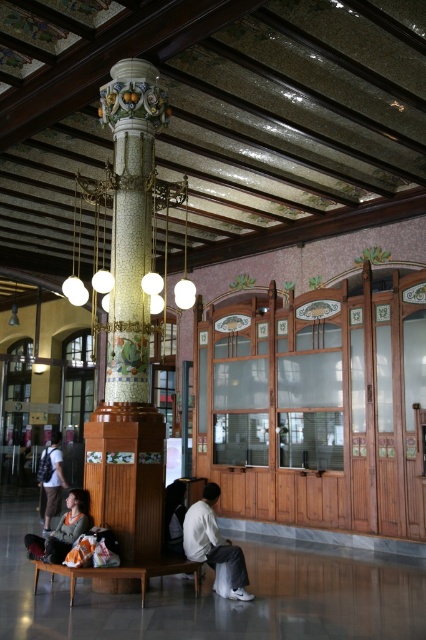
Consider the image. You are an observer standing in the grand building. You notice two items of clothing in the scene. The white matte shirt at center and the matte gray sweater at lower left. Which clothing item is positioned lower in the scene?

The white matte shirt at center is positioned lower than the matte gray sweater at lower left.

You are standing at the entrance of the grand building and see the matte glass chandelier at center and the matte gray sweater at lower left. Which object is closer to you?

The matte gray sweater at lower left is behind the matte glass chandelier at center, so the chandelier is closer to you.

You are a tailor observing the white matte shirt at center and the matte gray sweater at lower left in the image. Which garment is taller?

The white matte shirt at center is much taller than the matte gray sweater at lower left.